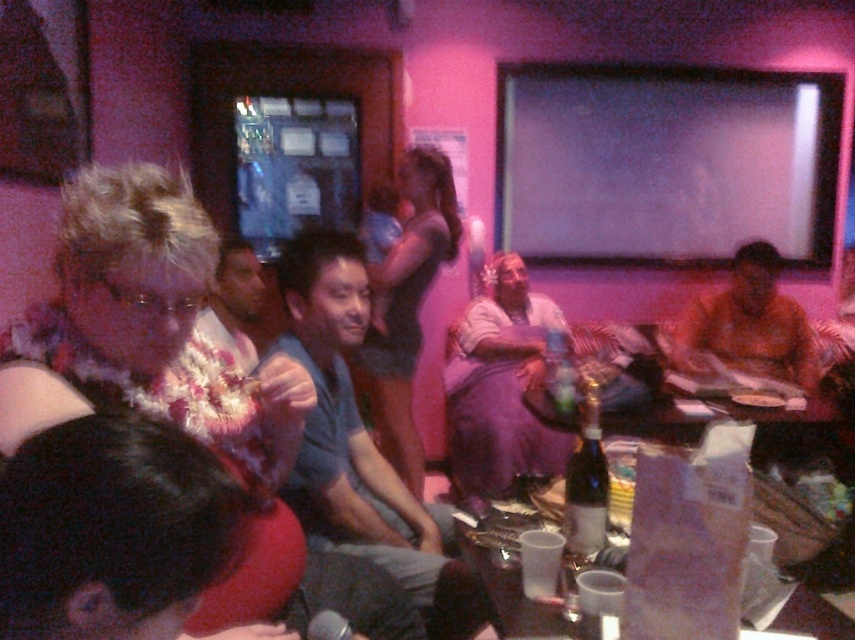
Looking at this image, who is more forward, (414, 260) or (245, 304)?

Positioned in front is point (245, 304).

Consider the image. Can you confirm if dark purple dress at center is wider than beige fabric shirt at center?

Answer: Correct, the width of dark purple dress at center exceeds that of beige fabric shirt at center.

Where is `dark purple dress at center`? dark purple dress at center is located at coordinates (405, 307).

Find the location of `dark purple dress at center`. dark purple dress at center is located at coordinates (405, 307).

Which is below, beige fabric shirt at center or bottled champagne at center?

bottled champagne at center

Does beige fabric shirt at center have a smaller size compared to bottled champagne at center?

Actually, beige fabric shirt at center might be larger than bottled champagne at center.

You are a GUI agent. You are given a task and a screenshot of the screen. Output one action in this format:
    pyautogui.click(x=<x>, y=<y>)
    Task: Click on the beige fabric shirt at center
    
    Given the screenshot: What is the action you would take?
    pyautogui.click(x=234, y=301)

Who is positioned more to the left, white floral lei at center or bottled champagne at center?

white floral lei at center is more to the left.

Is white floral lei at center positioned in front of bottled champagne at center?

Yes, it is.

Is point (93, 365) in front of point (596, 477)?

Yes, point (93, 365) is in front of point (596, 477).

Find the location of a particular element. white floral lei at center is located at coordinates (146, 330).